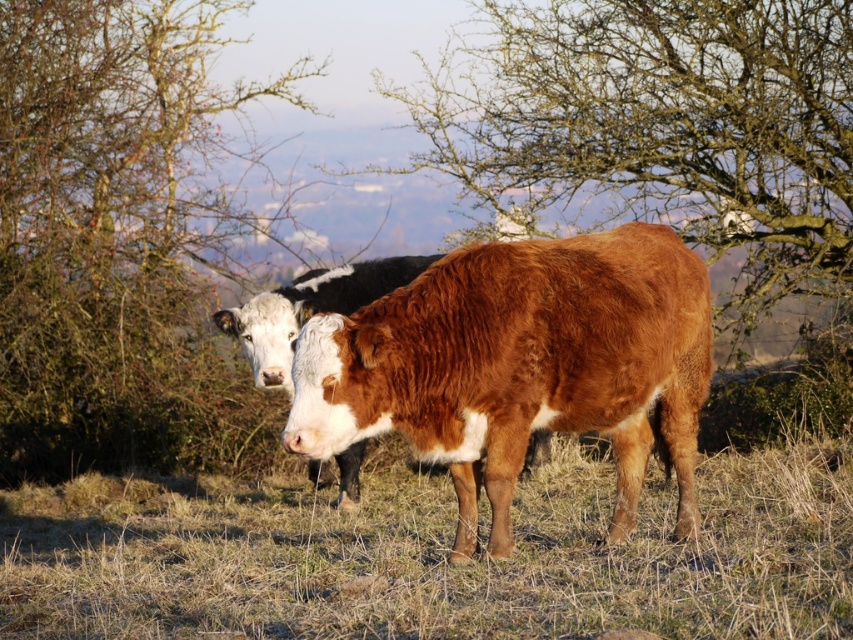
You are a farmer checking the field for the best spot to place a new water trough. The trough requires a flat area free of obstacles. Based on the image, is the point at coordinates point (433, 556) suitable for placing the trough?

The point at coordinates point (433, 556) has brown dry grass at center, which is flat and free of obstacles, making it suitable for placing the water trough.

You are a photographer aiming to capture both the green leafy tree at left and the brown textured cow at center in a single frame. Based on their positions, which object is closer to your camera?

The green leafy tree at left is closer to the camera since it is positioned further to the viewer than the brown textured cow at center.

You are a farmer looking at the image of your field. You see the green leafy tree at left and the brown textured cow at center. Which one is located more to the left side of the field?

The green leafy tree at left is more to the left side of the field because it is positioned on the left side of the brown textured cow at center.